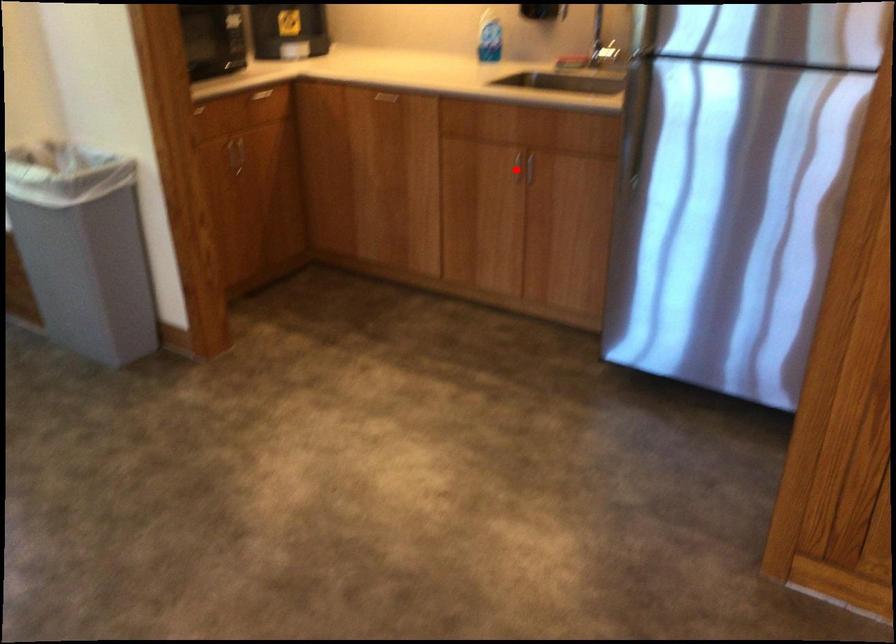
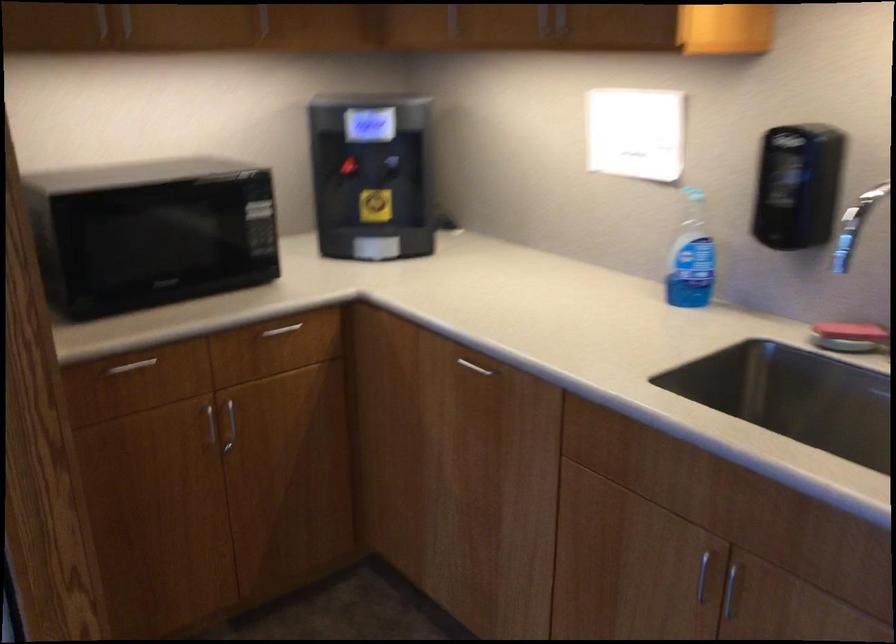
Where in the second image is the point corresponding to the highlighted location from the first image?

(702, 574)